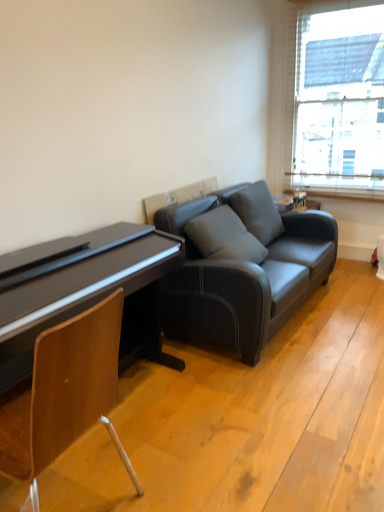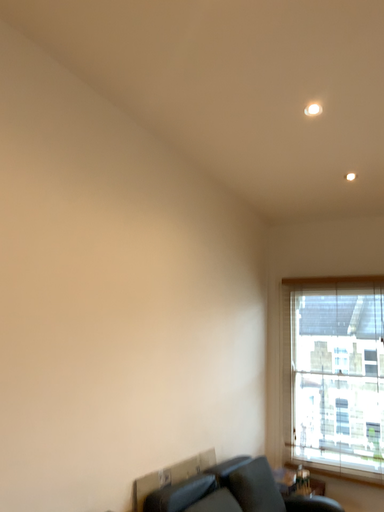
Question: Which way did the camera rotate in the video?

Choices:
 (A) rotated upward
 (B) rotated downward

Answer: (A)